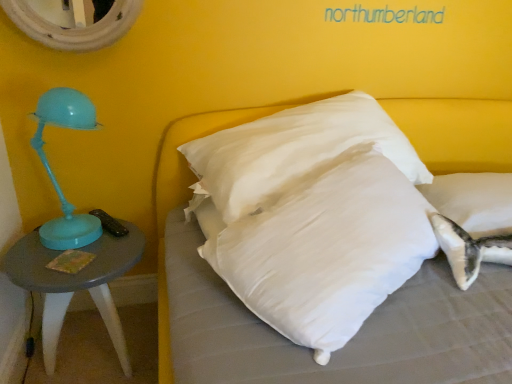
At what (x,y) coordinates should I click in order to perform the action: click on white soft pillow at center. Please return your answer as a coordinate pair (x, y). This screenshot has width=512, height=384. Looking at the image, I should click on (472, 220).

In order to face white soft pillow at center, should I rotate leftwards or rightwards?

To align with it, rotate right about 29.232°.

Locate an element on the screen. white textured mirror at upper left is located at coordinates (72, 22).

You are a GUI agent. You are given a task and a screenshot of the screen. Output one action in this format:
    pyautogui.click(x=<x>, y=<y>)
    Task: Click on the white soft pillow at center
    This screenshot has height=384, width=512.
    Given the screenshot: What is the action you would take?
    pyautogui.click(x=472, y=220)

Considering the sizes of objects matte gray table at left and white soft pillow at center in the image provided, who is smaller, matte gray table at left or white soft pillow at center?

white soft pillow at center is smaller.

What's the angular difference between matte gray table at left and white soft pillow at center's facing directions?

matte gray table at left and white soft pillow at center are facing 6.89 degrees away from each other.

Who is taller, matte gray table at left or white soft pillow at center?

matte gray table at left is taller.

Based on the photo, between white soft pillow at center and matte gray table at left, which one has larger width?

Wider between the two is white soft pillow at center.

Is white soft pillow at center looking in the opposite direction of matte gray table at left?

white soft pillow at center is not turned away from matte gray table at left.

From the image's perspective, who appears lower, white soft pillow at center or matte gray table at left?

matte gray table at left, from the image's perspective.

Find the location of `table in front of the white textured mirror at upper left`. table in front of the white textured mirror at upper left is located at coordinates pos(75,283).

From a real-world perspective, relative to white textured mirror at upper left, is matte gray table at left vertically above or below?

Clearly, from a real-world perspective, matte gray table at left is below white textured mirror at upper left.

Would you say matte gray table at left is to the left or to the right of white textured mirror at upper left in the picture?

In the image, matte gray table at left appears on the left side of white textured mirror at upper left.

Can you tell me how much matte gray table at left and white textured mirror at upper left differ in facing direction?

1.07 degrees separate the facing orientations of matte gray table at left and white textured mirror at upper left.

Is white textured mirror at upper left oriented away from matte gray table at left?

That's not correct — white textured mirror at upper left is not looking away from matte gray table at left.

From a real-world perspective, who is located higher, white textured mirror at upper left or matte gray table at left?

white textured mirror at upper left is physically above.

Would you consider white textured mirror at upper left to be distant from matte gray table at left?

No, white textured mirror at upper left is not far from matte gray table at left.

Is white textured mirror at upper left in front of matte gray table at left?

That is False.

Considering the sizes of objects white textured mirror at upper left and white soft pillow at center in the image provided, who is thinner, white textured mirror at upper left or white soft pillow at center?

white textured mirror at upper left is thinner.

From a real-world perspective, between white textured mirror at upper left and white soft pillow at center, who is vertically higher?

white textured mirror at upper left, from a real-world perspective.

Is white textured mirror at upper left spatially inside white soft pillow at center, or outside of it?

white textured mirror at upper left cannot be found inside white soft pillow at center.

Would you consider white textured mirror at upper left to be distant from white soft pillow at center?

Yes, white textured mirror at upper left and white soft pillow at center are quite far apart.

This screenshot has height=384, width=512. Identify the location of pillow to the right of white soft pillow at center. (472, 220).

In terms of width, does white soft pillow at center look wider or thinner when compared to white soft pillow at center?

Clearly, white soft pillow at center has more width compared to white soft pillow at center.

Considering the points (469, 183) and (449, 115), which point is behind, point (469, 183) or point (449, 115)?

The point (449, 115) is farther.

Which object is further away from the camera taking this photo, white soft pillow at center or white soft pillow at center?

white soft pillow at center is more distant.

From the picture: From the image's perspective, which object appears higher, white soft pillow at center or white soft pillow at center?

white soft pillow at center.

Can we say white soft pillow at center lies outside white soft pillow at center?

Yes.

Which object is thinner, white soft pillow at center or white soft pillow at center?

Thinner between the two is white soft pillow at center.

Find the location of `pillow behind the matte gray table at left`. pillow behind the matte gray table at left is located at coordinates (472, 220).

You are a GUI agent. You are given a task and a screenshot of the screen. Output one action in this format:
    pyautogui.click(x=<x>, y=<y>)
    Task: Click on the bed in front of the matte gray table at left
    The image size is (512, 384).
    Given the screenshot: What is the action you would take?
    pyautogui.click(x=457, y=132)

Based on their spatial positions, is white soft pillow at center or white soft pillow at center further from white textured mirror at upper left?

Based on the image, white soft pillow at center appears to be further to white textured mirror at upper left.

Looking at this image, estimate the real-world distances between objects in this image. Which object is closer to matte gray table at left, white soft pillow at center or white soft pillow at center?

white soft pillow at center is closer to matte gray table at left.

Looking at the image, which one is located further to white textured mirror at upper left, white soft pillow at center or white soft pillow at center?

Based on the image, white soft pillow at center appears to be further to white textured mirror at upper left.

Which object lies nearer to the anchor point white soft pillow at center, white textured mirror at upper left or white soft pillow at center?

white soft pillow at center is positioned closer to the anchor white soft pillow at center.

Based on their spatial positions, is white soft pillow at center or white soft pillow at center further from matte gray table at left?

The object further to matte gray table at left is white soft pillow at center.

Which object lies further to the anchor point white soft pillow at center, white soft pillow at center or white textured mirror at upper left?

Among the two, white textured mirror at upper left is located further to white soft pillow at center.

From the image, which object appears to be farther from matte gray table at left, white textured mirror at upper left or white soft pillow at center?

The object further to matte gray table at left is white soft pillow at center.

From the image, which object appears to be nearer to white soft pillow at center, white soft pillow at center or matte gray table at left?

The object closer to white soft pillow at center is white soft pillow at center.

I want to click on bed located between matte gray table at left and white soft pillow at center in the left-right direction, so click(457, 132).

This screenshot has height=384, width=512. I want to click on bed between white textured mirror at upper left and white soft pillow at center from left to right, so click(x=457, y=132).

Where is `mirror situated between matte gray table at left and white soft pillow at center from left to right`? Image resolution: width=512 pixels, height=384 pixels. mirror situated between matte gray table at left and white soft pillow at center from left to right is located at coordinates (72, 22).

Locate an element on the screen. The height and width of the screenshot is (384, 512). mirror located between matte gray table at left and white soft pillow at center in the left-right direction is located at coordinates (72, 22).